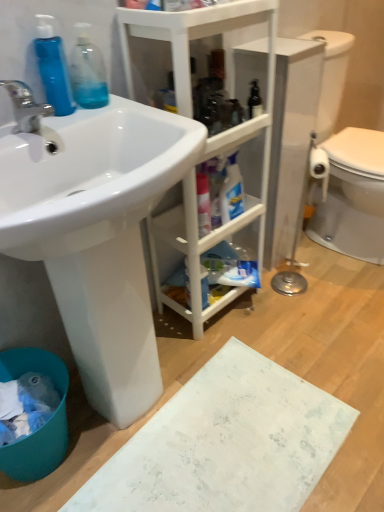
Question: Considering their positions, is matte silver faucet at left located in front of or behind blue plastic bottle at left, which appears as the second cleaning product when viewed from the right?

Choices:
 (A) front
 (B) behind

Answer: (A)

Question: From a real-world perspective, relative to blue plastic bottle at left, which appears as the second cleaning product when viewed from the right, is matte silver faucet at left vertically above or below?

Choices:
 (A) above
 (B) below

Answer: (B)

Question: Which of these objects is positioned closest to the white glossy sink at upper left?

Choices:
 (A) matte silver faucet at left
 (B) white matte cabinet at center
 (C) transparent plastic bottle at upper left, the 1th cleaning product positioned from the right
 (D) blue plastic bottle at left, the first cleaning product when ordered from left to right
 (E) blue plastic bucket at lower left

Answer: (B)

Question: Which object is positioned closest to the blue plastic bottle at left, which appears as the second cleaning product when viewed from the right?

Choices:
 (A) blue plastic bucket at lower left
 (B) white glossy sink at upper left
 (C) transparent plastic bottle at upper left, the 2th cleaning product when ordered from left to right
 (D) white matte cabinet at center
 (E) matte silver faucet at left

Answer: (C)